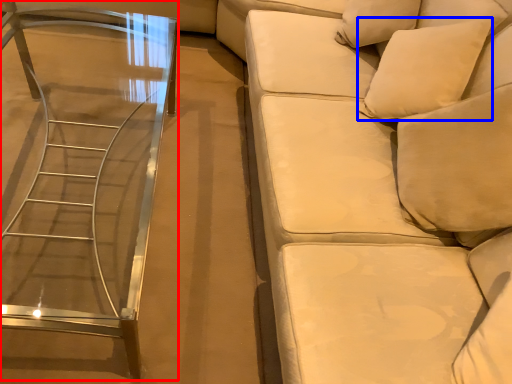
Question: Among these objects, which one is nearest to the camera, table (highlighted by a red box) or pillow (highlighted by a blue box)?

Choices:
 (A) table
 (B) pillow

Answer: (A)